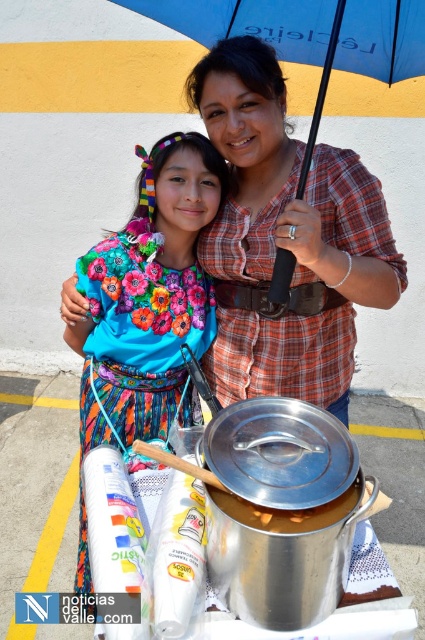
Does plaid fabric shirt at center appear on the right side of shiny silver pot at center?

Indeed, plaid fabric shirt at center is positioned on the right side of shiny silver pot at center.

Is plaid fabric shirt at center shorter than shiny silver pot at center?

In fact, plaid fabric shirt at center may be taller than shiny silver pot at center.

Measure the distance between point [249,296] and camera.

5.44 feet

Where is `plaid fabric shirt at center`? Image resolution: width=425 pixels, height=640 pixels. plaid fabric shirt at center is located at coordinates (286, 237).

Can you confirm if plaid fabric shirt at center is thinner than blue fabric umbrella at upper center?

Yes, plaid fabric shirt at center is thinner than blue fabric umbrella at upper center.

Between plaid fabric shirt at center and blue fabric umbrella at upper center, which one is positioned lower?

plaid fabric shirt at center

Image resolution: width=425 pixels, height=640 pixels. Find the location of `plaid fabric shirt at center`. plaid fabric shirt at center is located at coordinates tap(286, 237).

Based on the photo, can you confirm if floral fabric dress at center is wider than shiny silver pot at center?

Yes, floral fabric dress at center is wider than shiny silver pot at center.

Is floral fabric dress at center bigger than shiny silver pot at center?

Yes.

The image size is (425, 640). What do you see at coordinates (147, 298) in the screenshot?
I see `floral fabric dress at center` at bounding box center [147, 298].

Locate an element on the screen. The image size is (425, 640). floral fabric dress at center is located at coordinates (147, 298).